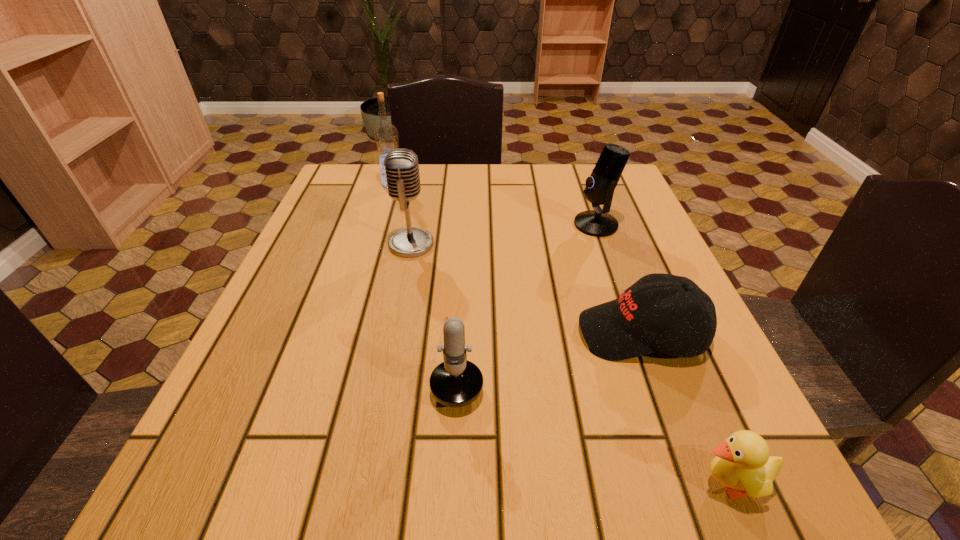
Find the location of a particular element. vacant space that is in between the baseball cap and the farthest object is located at coordinates pos(517,259).

Where is `free space between the duckling and the third object from left to right`? This screenshot has width=960, height=540. free space between the duckling and the third object from left to right is located at coordinates (593, 422).

Image resolution: width=960 pixels, height=540 pixels. I want to click on free point between the vodka and the third object from left to right, so click(x=425, y=273).

Identify the location of empty space between the leftmost object and the third object from left to right. This screenshot has height=540, width=960. (425, 273).

Where is `free space that is in between the baseball cap and the third shortest object`? The width and height of the screenshot is (960, 540). free space that is in between the baseball cap and the third shortest object is located at coordinates (550, 347).

Find the location of `free spot between the third shortest object and the baseball cap`. free spot between the third shortest object and the baseball cap is located at coordinates (550, 347).

Point out which object is positioned as the fourth nearest to the nearest object. Please provide its 2D coordinates. Your answer should be formatted as a tuple, i.e. [(x, y)], where the tuple contains the x and y coordinates of a point satisfying the conditions above.

[(401, 166)]

Identify which object is located as the third nearest to the rightmost microphone. Please provide its 2D coordinates. Your answer should be formatted as a tuple, i.e. [(x, y)], where the tuple contains the x and y coordinates of a point satisfying the conditions above.

[(456, 382)]

Where is `microphone that is the second nearest to the leftmost object`? microphone that is the second nearest to the leftmost object is located at coordinates (600, 186).

The height and width of the screenshot is (540, 960). Identify the location of microphone object that ranks as the closest to the rightmost microphone. (401, 166).